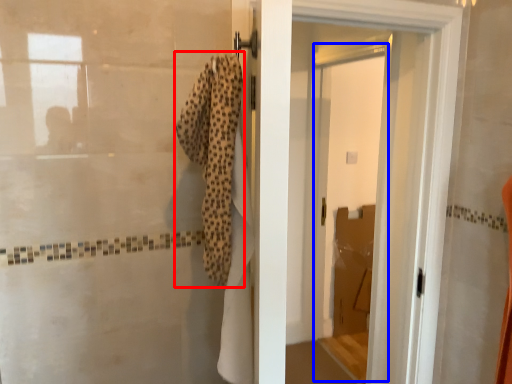
Question: Which object is further to the camera taking this photo, bath towel (highlighted by a red box) or screen door (highlighted by a blue box)?

Choices:
 (A) bath towel
 (B) screen door

Answer: (B)